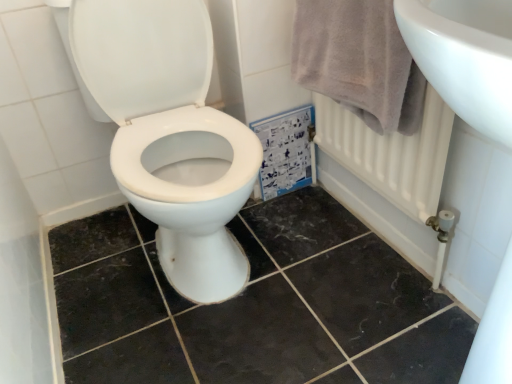
Question: Is there a large distance between light gray cotton towel at upper right and white glossy toilet at center?

Choices:
 (A) yes
 (B) no

Answer: (B)

Question: From a real-world perspective, is light gray cotton towel at upper right on top of white glossy toilet at center?

Choices:
 (A) no
 (B) yes

Answer: (B)

Question: Are light gray cotton towel at upper right and white glossy toilet at center beside each other?

Choices:
 (A) no
 (B) yes

Answer: (A)

Question: Is light gray cotton towel at upper right completely or partially outside of white glossy toilet at center?

Choices:
 (A) yes
 (B) no

Answer: (A)

Question: From the image's perspective, does light gray cotton towel at upper right appear lower than white glossy toilet at center?

Choices:
 (A) yes
 (B) no

Answer: (B)

Question: Does light gray cotton towel at upper right turn towards white glossy toilet at center?

Choices:
 (A) no
 (B) yes

Answer: (B)

Question: Can you confirm if black marble tile at center is wider than light gray cotton towel at upper right?

Choices:
 (A) no
 (B) yes

Answer: (B)

Question: Does black marble tile at center have a greater height compared to light gray cotton towel at upper right?

Choices:
 (A) yes
 (B) no

Answer: (B)

Question: Is the position of black marble tile at center more distant than that of light gray cotton towel at upper right?

Choices:
 (A) yes
 (B) no

Answer: (B)

Question: Is the position of black marble tile at center less distant than that of light gray cotton towel at upper right?

Choices:
 (A) yes
 (B) no

Answer: (A)

Question: From the image's perspective, would you say black marble tile at center is shown under light gray cotton towel at upper right?

Choices:
 (A) yes
 (B) no

Answer: (A)

Question: Is black marble tile at center smaller than light gray cotton towel at upper right?

Choices:
 (A) no
 (B) yes

Answer: (A)

Question: Considering the relative sizes of light gray cotton towel at upper right and black marble tile at center in the image provided, is light gray cotton towel at upper right bigger than black marble tile at center?

Choices:
 (A) no
 (B) yes

Answer: (A)